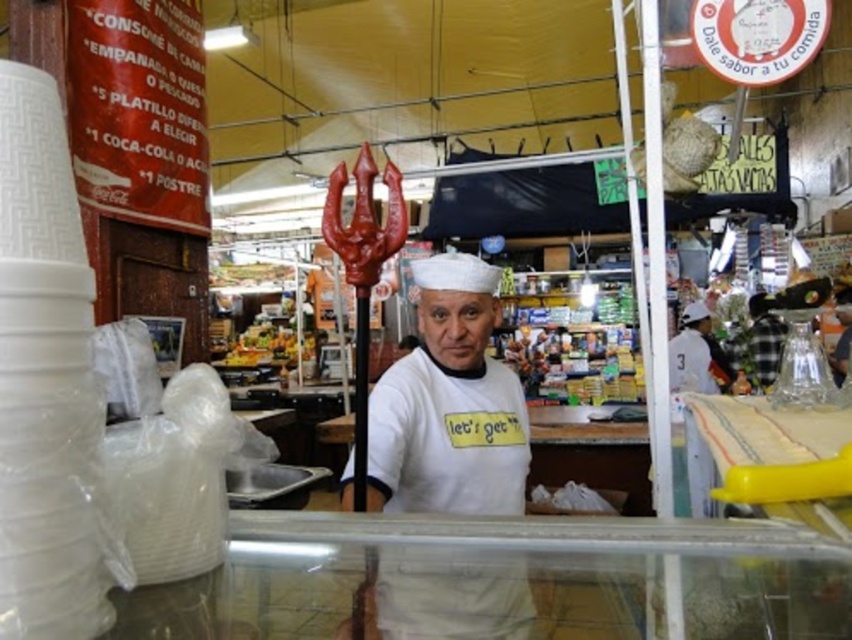
Question: Considering the relative positions of white matte chef hat at center and shiny plastic fruits at center in the image provided, where is white matte chef hat at center located with respect to shiny plastic fruits at center?

Choices:
 (A) right
 (B) left

Answer: (A)

Question: Which of the following is the farthest from the observer?

Choices:
 (A) shiny plastic fruits at center
 (B) white matte chef hat at center

Answer: (A)

Question: Which point is closer to the camera?

Choices:
 (A) (249, 328)
 (B) (455, 305)

Answer: (B)

Question: Can you confirm if white matte chef hat at center is bigger than shiny plastic fruits at center?

Choices:
 (A) no
 (B) yes

Answer: (A)

Question: From the image, what is the correct spatial relationship of white matte chef hat at center in relation to shiny plastic fruits at center?

Choices:
 (A) below
 (B) above

Answer: (B)